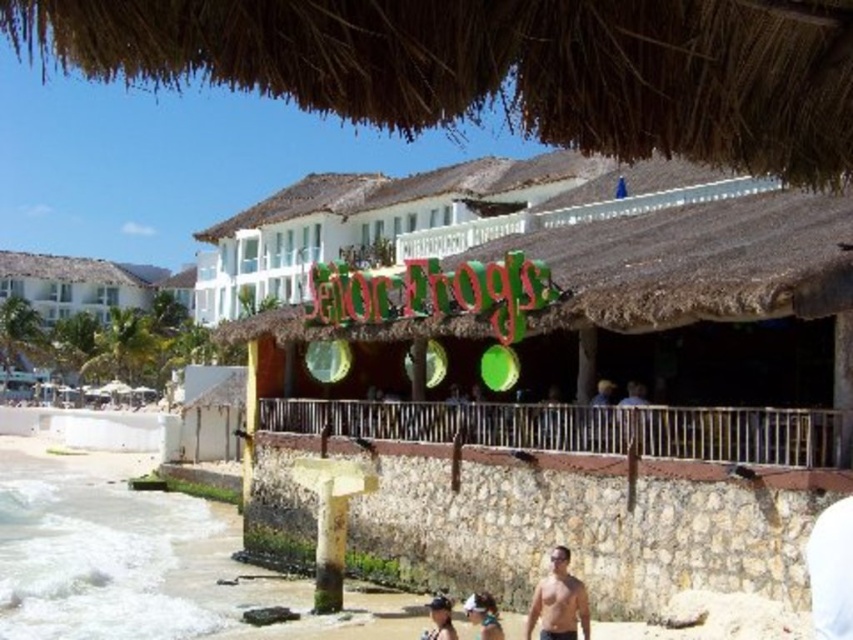
Question: Among these points, which one is farthest from the camera?

Choices:
 (A) (473, 616)
 (B) (440, 600)
 (C) (637, 400)

Answer: (C)

Question: Is white fabric visor at lower center to the left of smooth tan skin at center from the viewer's perspective?

Choices:
 (A) yes
 (B) no

Answer: (A)

Question: Which of the following is the closest to the observer?

Choices:
 (A) matte white shirt at lower center
 (B) smooth tan skin at center
 (C) white fabric visor at lower center
 (D) smooth skin torso at lower right

Answer: (C)

Question: Considering the real-world distances, which object is farthest from the smooth tan skin at center?

Choices:
 (A) white fabric visor at lower center
 (B) smooth skin torso at lower right

Answer: (A)

Question: Can you confirm if smooth skin torso at lower right is positioned to the left of white fabric visor at lower center?

Choices:
 (A) yes
 (B) no

Answer: (B)

Question: Is smooth skin torso at lower right below matte white shirt at lower center?

Choices:
 (A) no
 (B) yes

Answer: (A)